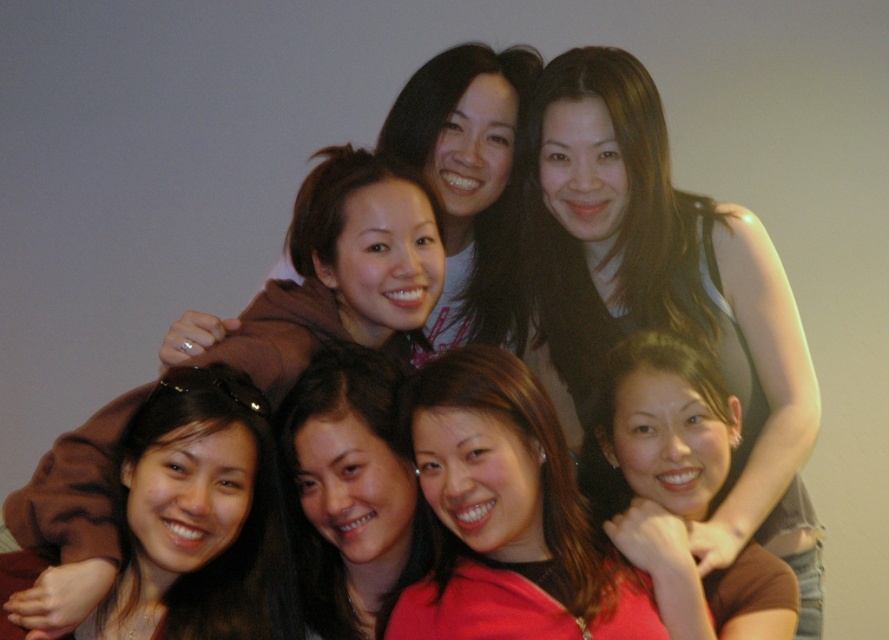
You are a photographer trying to adjust the lighting for a group photo. You notice the matte red shirt at center and the smooth brown hair at center. Which object should you focus on first to ensure proper exposure, considering their position?

The matte red shirt at center should be focused on first because it is in front of the smooth brown hair at center, making it closer to the camera and requiring proper exposure first.

Consider the image. You are a photographer trying to adjust the lighting for a group photo. You notice two shirts in the center of the image, a matte red shirt at center and a matte brown shirt at center. Which shirt is closer to the camera?

The matte red shirt at center is shorter than the matte brown shirt at center, so it is closer to the camera.

You are a photographer adjusting the lighting for a group photo. You notice the matte black tank top at upper right and the matte brown shirt at center. Which of these two should you focus on first to ensure proper exposure, considering their positions?

The matte black tank top at upper right is closer to you than the matte brown shirt at center, so you should focus on the matte black tank top at upper right first to ensure proper exposure.